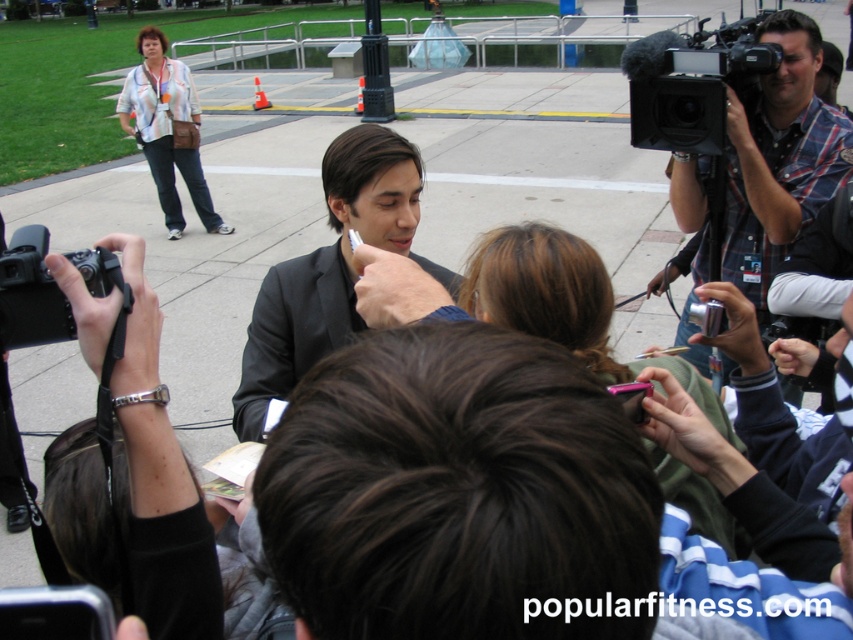
You are a photographer at the event and need to store both the black plastic camera at lower left and the blue fabric shirt at center in a small bag. Given their sizes, which item might be more challenging to fit into the bag?

The black plastic camera at lower left is larger than the blue fabric shirt at center, so it might be more challenging to fit into the small bag.